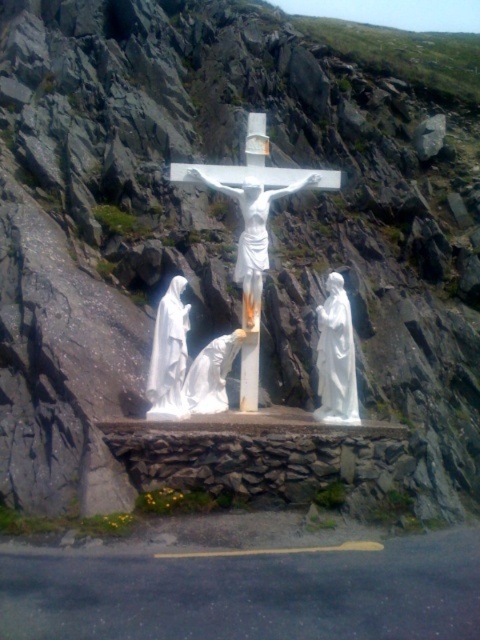
Question: Can you confirm if white marble crucifix at center is positioned to the right of white glossy statue at center?

Choices:
 (A) yes
 (B) no

Answer: (A)

Question: In this image, where is white marble statue at left located relative to white glossy statue at center?

Choices:
 (A) below
 (B) above

Answer: (B)

Question: Does white marble statue at left have a smaller size compared to white glossy statue at center?

Choices:
 (A) no
 (B) yes

Answer: (B)

Question: Which point is closer to the camera?

Choices:
 (A) (152, 404)
 (B) (242, 189)
 (C) (332, 308)

Answer: (A)

Question: Which of the following is the closest to the observer?

Choices:
 (A) white marble statue at left
 (B) white glossy statue at center

Answer: (A)

Question: Which of the following is the closest to the observer?

Choices:
 (A) white marble crucifix at center
 (B) white marble statue at left
 (C) white marble statue at right

Answer: (B)